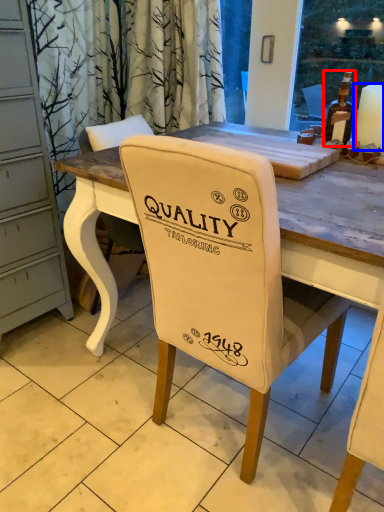
Question: Which point is closer to the camera, bottle (highlighted by a red box) or candle (highlighted by a blue box)?

Choices:
 (A) bottle
 (B) candle

Answer: (B)